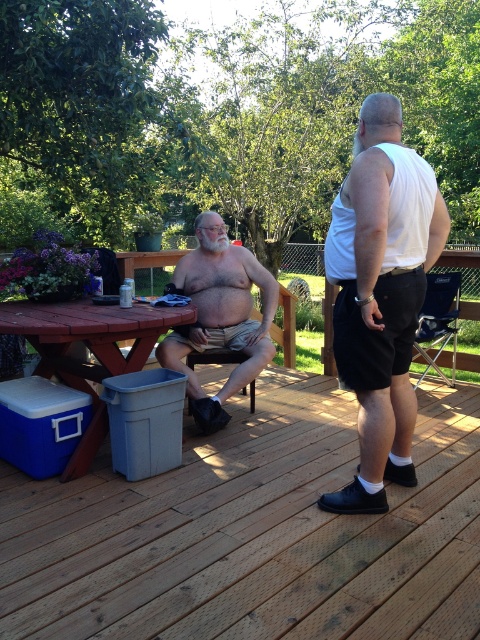
Based on the scene description, can you determine if the white matte tank top at center is positioned higher than the beige cotton shorts at center?

The white matte tank top at center is above beige cotton shorts at center, so yes, it is positioned higher.

Based on the photo, you are standing at the picnic table with a red surface on the left side of the frame and want to place a new item at one of two specific points. The first point is at coordinates point (187,289) and the second is at point (145,340). According to the spatial relationship between these two points, which point is located behind the other?

Point (187,289) is behind point (145,340).